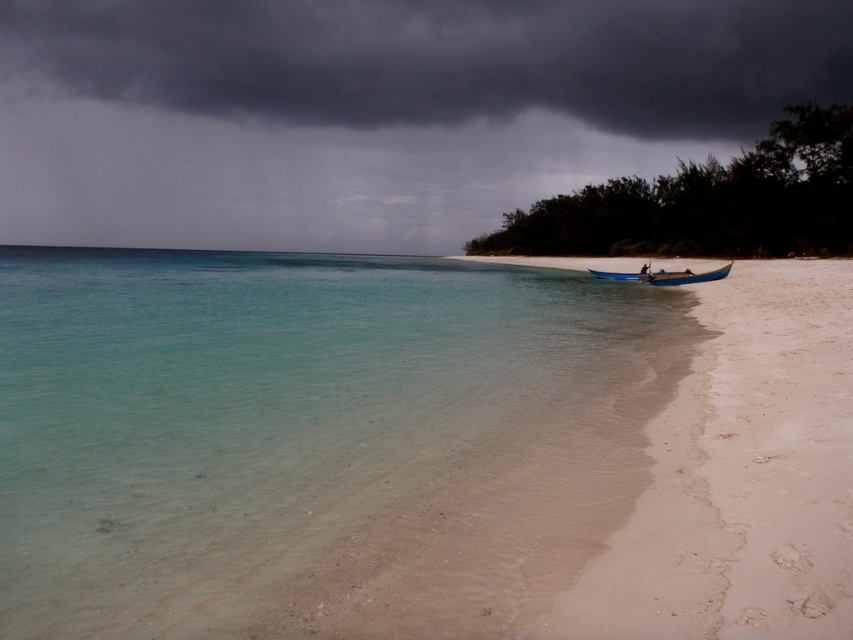
You are a photographer standing at the shoreline. You want to capture a photo where both the white sandy beach at lower right and the blue polished wood boat at lower right are clearly visible. Which object should you position closer to the front of the frame to ensure both are in focus?

Since the white sandy beach at lower right is taller than the blue polished wood boat at lower right, positioning the boat closer to the front of the frame will help keep both objects in focus by reducing the depth of field difference between them.

You are standing on the beach and looking towards the horizon. Which object, the dark gray cloud at upper center or the blue polished wood boat at lower right, is higher in the sky?

The dark gray cloud at upper center is higher in the sky than the blue polished wood boat at lower right because it is positioned above it according to the description.